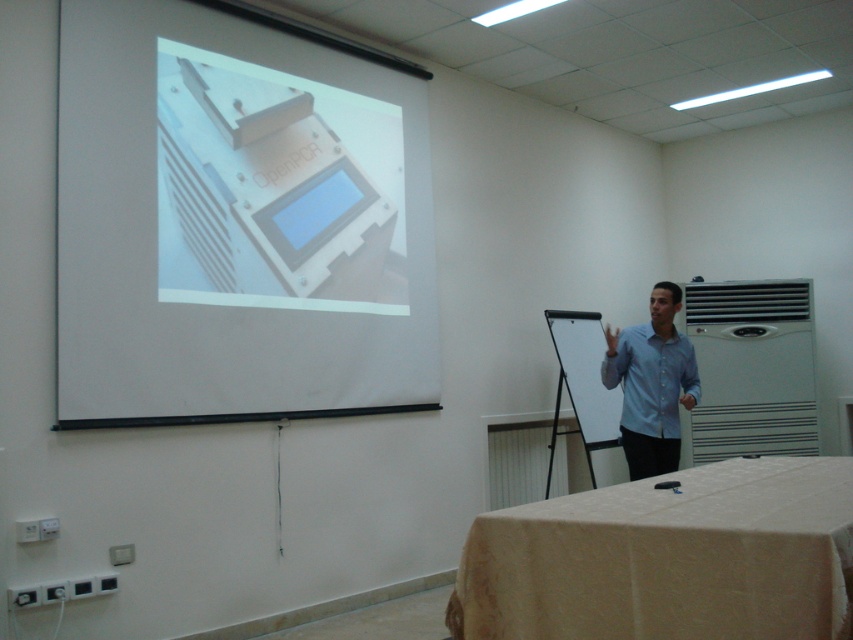
Question: Can you confirm if white matte projector screen at upper left is positioned below blue plastic screen at upper center?

Choices:
 (A) yes
 (B) no

Answer: (A)

Question: Can you confirm if white matte projector screen at upper left is positioned to the left of beige fabric table at lower right?

Choices:
 (A) no
 (B) yes

Answer: (B)

Question: Which point is closer to the camera taking this photo?

Choices:
 (A) (437, 385)
 (B) (292, 225)
 (C) (630, 442)

Answer: (B)

Question: Which of the following is the closest to the observer?

Choices:
 (A) pyautogui.click(x=206, y=74)
 (B) pyautogui.click(x=616, y=332)

Answer: (A)

Question: Does beige fabric table at lower right have a lesser width compared to blue plastic screen at upper center?

Choices:
 (A) yes
 (B) no

Answer: (B)

Question: Which point appears farthest from the camera in this image?

Choices:
 (A) (473, 566)
 (B) (76, 193)
 (C) (677, 436)
 (D) (302, 214)

Answer: (C)